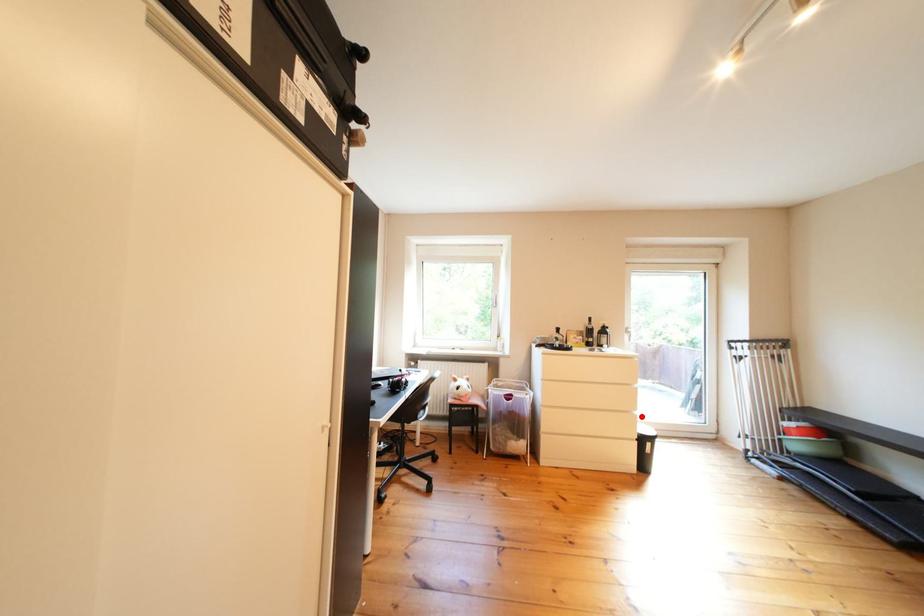
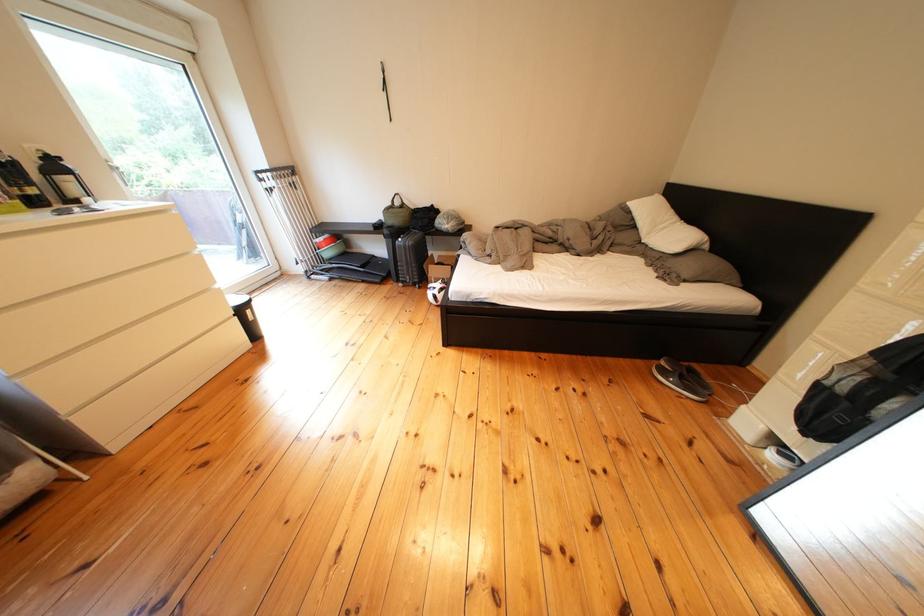
Question: I am providing you with two images of the same scene from different viewpoints. A red point is shown in image1. For the corresponding object point in image2, is it positioned nearer or farther from the camera?

Choices:
 (A) Nearer
 (B) Farther

Answer: (A)